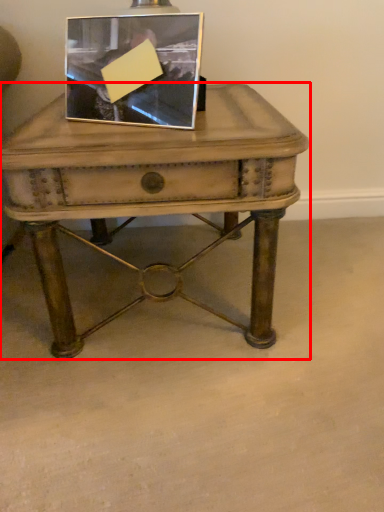
Question: From the image's perspective, considering the relative positions of table (annotated by the red box) and picture frame in the image provided, where is table (annotated by the red box) located with respect to the staircase?

Choices:
 (A) above
 (B) below

Answer: (B)